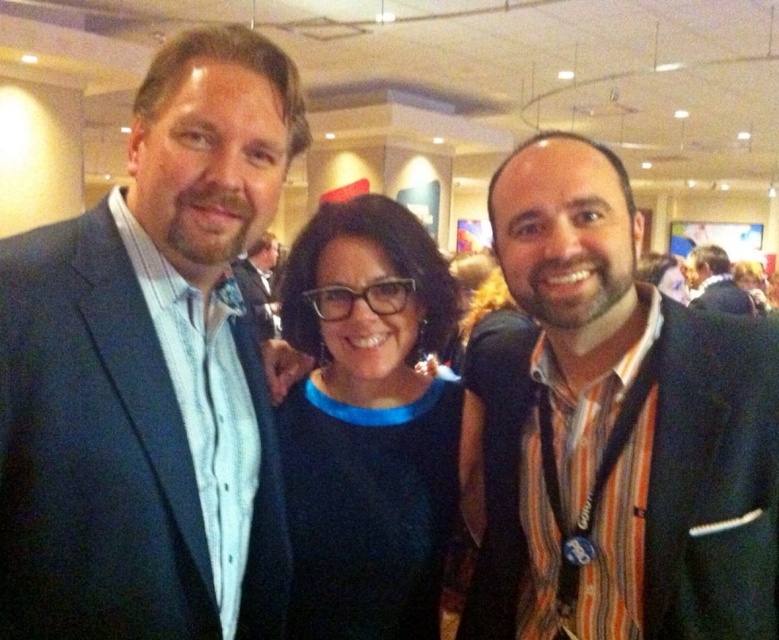
You are standing at the origin point of the image coordinate system. You want to walk towards the point at (566,467). However, there is an obstacle at point (206,160). Will you encounter the obstacle before reaching your destination?

Yes, you will encounter the obstacle at point (206,160) before reaching point (566,467) because point (206,160) is in front of point (566,467).